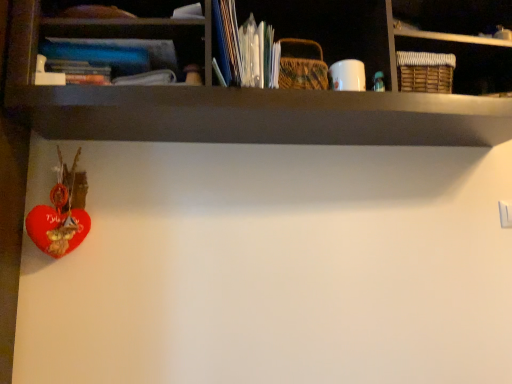
Question: Is velvet red heart at lower left facing away from blue hardcover book at upper left?

Choices:
 (A) no
 (B) yes

Answer: (A)

Question: From a real-world perspective, is velvet red heart at lower left on blue hardcover book at upper left?

Choices:
 (A) yes
 (B) no

Answer: (B)

Question: Considering the relative positions of velvet red heart at lower left and blue hardcover book at upper left in the image provided, is velvet red heart at lower left to the left of blue hardcover book at upper left from the viewer's perspective?

Choices:
 (A) no
 (B) yes

Answer: (B)

Question: Is velvet red heart at lower left shorter than blue hardcover book at upper left?

Choices:
 (A) no
 (B) yes

Answer: (A)

Question: From the image's perspective, would you say velvet red heart at lower left is shown under blue hardcover book at upper left?

Choices:
 (A) yes
 (B) no

Answer: (A)

Question: Considering the relative positions of velvet red heart at lower left and blue hardcover book at upper left in the image provided, is velvet red heart at lower left to the right of blue hardcover book at upper left from the viewer's perspective?

Choices:
 (A) no
 (B) yes

Answer: (A)

Question: Is blue hardcover book at upper left wider than velvet red heart at lower left?

Choices:
 (A) yes
 (B) no

Answer: (A)

Question: Is the depth of blue hardcover book at upper left less than that of velvet red heart at lower left?

Choices:
 (A) no
 (B) yes

Answer: (B)

Question: From a real-world perspective, is blue hardcover book at upper left physically above velvet red heart at lower left?

Choices:
 (A) no
 (B) yes

Answer: (B)

Question: From a real-world perspective, is blue hardcover book at upper left positioned under velvet red heart at lower left based on gravity?

Choices:
 (A) yes
 (B) no

Answer: (B)

Question: Does blue hardcover book at upper left contain velvet red heart at lower left?

Choices:
 (A) no
 (B) yes

Answer: (A)

Question: Can you confirm if blue hardcover book at upper left is taller than velvet red heart at lower left?

Choices:
 (A) yes
 (B) no

Answer: (B)

Question: Considering the positions of velvet red heart at lower left and blue hardcover book at upper left in the image, is velvet red heart at lower left taller or shorter than blue hardcover book at upper left?

Choices:
 (A) short
 (B) tall

Answer: (B)